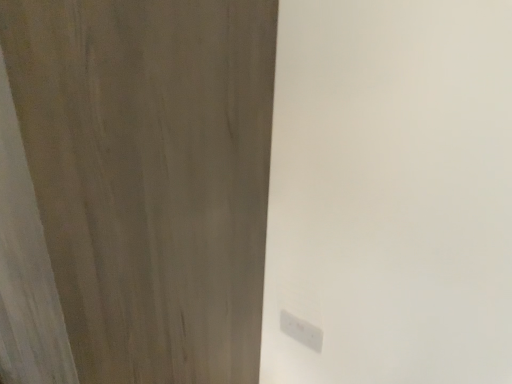
The height and width of the screenshot is (384, 512). Describe the element at coordinates (301, 331) in the screenshot. I see `white plastic electric outlet at lower right` at that location.

The height and width of the screenshot is (384, 512). I want to click on white plastic electric outlet at lower right, so click(x=301, y=331).

I want to click on white plastic electric outlet at lower right, so click(301, 331).